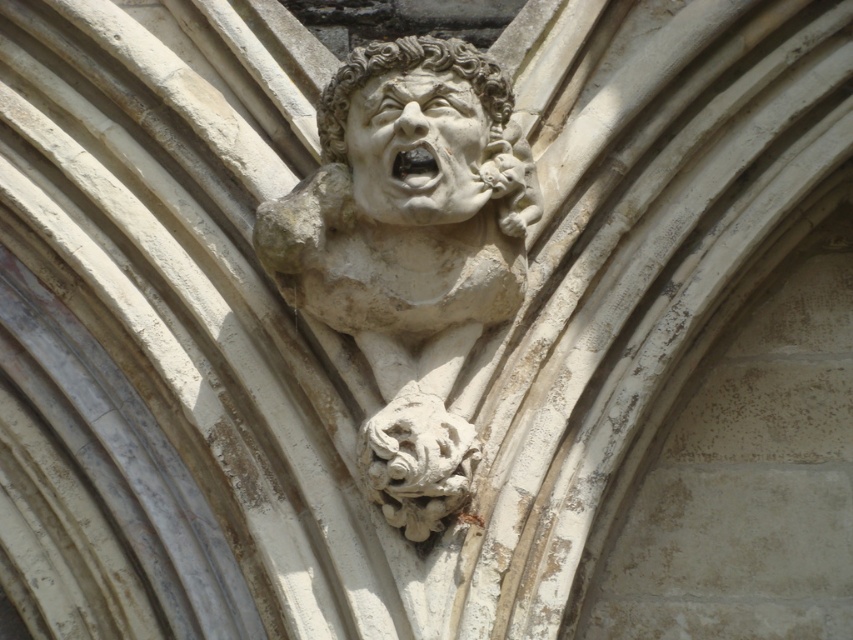
Between white stone gargoyle at center and smooth stone face at upper center, which one appears on the right side from the viewer's perspective?

smooth stone face at upper center

Which of these two, white stone gargoyle at center or smooth stone face at upper center, stands shorter?

With less height is smooth stone face at upper center.

Find the location of a particular element. The height and width of the screenshot is (640, 853). white stone gargoyle at center is located at coordinates (409, 250).

Locate an element on the screen. white stone gargoyle at center is located at coordinates (409, 250).